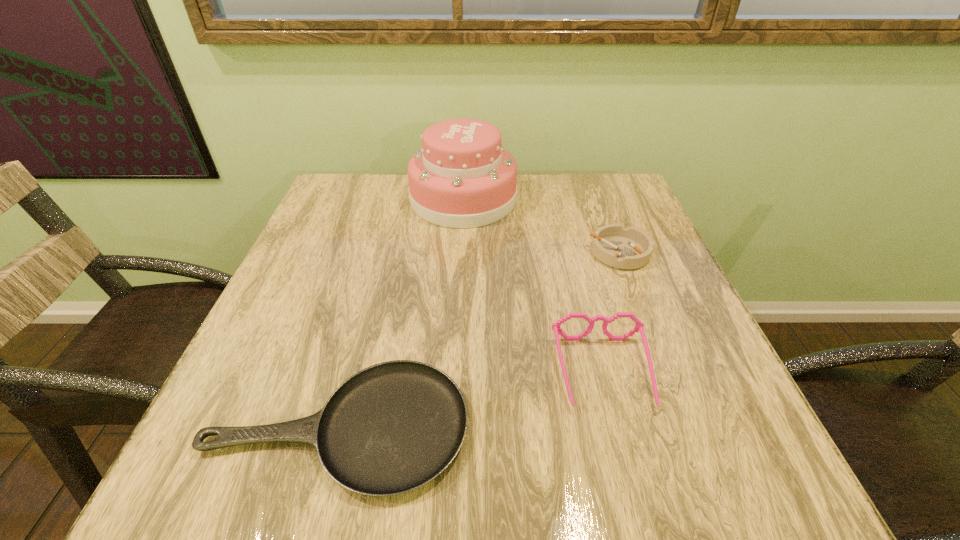
Identify the location of vacant area that lies between the spectacles and the third tallest object. This screenshot has width=960, height=540. (612, 313).

Find the location of a particular element. This screenshot has width=960, height=540. free space that is in between the farthest object and the third tallest object is located at coordinates (541, 226).

This screenshot has height=540, width=960. What are the coordinates of `object that stands as the closest to the third shortest object` in the screenshot? It's located at (391, 428).

Identify which object is the nearest to the third tallest object. Please provide its 2D coordinates. Your answer should be formatted as a tuple, i.e. [(x, y)], where the tuple contains the x and y coordinates of a point satisfying the conditions above.

[(463, 177)]

You are a GUI agent. You are given a task and a screenshot of the screen. Output one action in this format:
    pyautogui.click(x=<x>, y=<y>)
    Task: Click on the vacant position in the image that satisfies the following two spatial constraints: 1. on the front side of the second shortest object; 2. on the left side of the tallest object
    The width and height of the screenshot is (960, 540).
    Given the screenshot: What is the action you would take?
    pyautogui.click(x=461, y=253)

Image resolution: width=960 pixels, height=540 pixels. I want to click on free space that satisfies the following two spatial constraints: 1. on the front side of the farthest object; 2. on the right side of the third tallest object, so click(461, 253).

The height and width of the screenshot is (540, 960). Find the location of `free spot that satisfies the following two spatial constraints: 1. on the back side of the second farthest object; 2. on the left side of the frying pan`. free spot that satisfies the following two spatial constraints: 1. on the back side of the second farthest object; 2. on the left side of the frying pan is located at coordinates (384, 253).